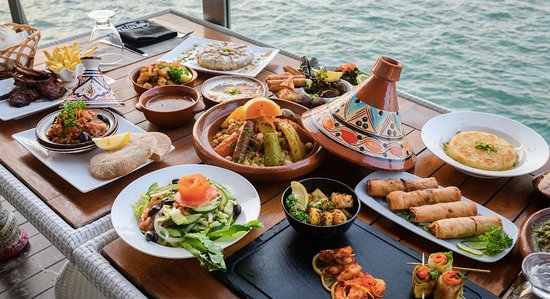
You are a GUI agent. You are given a task and a screenshot of the screen. Output one action in this format:
    pyautogui.click(x=<x>, y=<y>)
    Task: Click on the plate
    
    Given the screenshot: What is the action you would take?
    pyautogui.click(x=74, y=163), pyautogui.click(x=13, y=113), pyautogui.click(x=189, y=49), pyautogui.click(x=385, y=206)